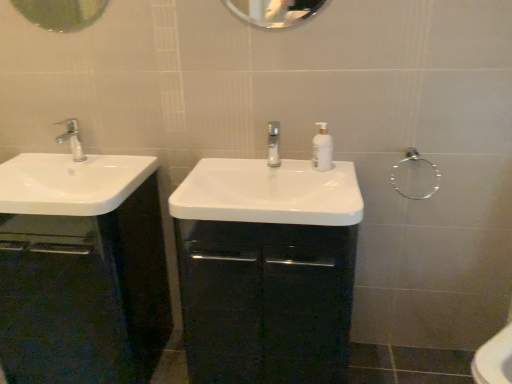
The width and height of the screenshot is (512, 384). What are the coordinates of `vacant area in front of white glossy soap dispenser at center` in the screenshot? It's located at (331, 192).